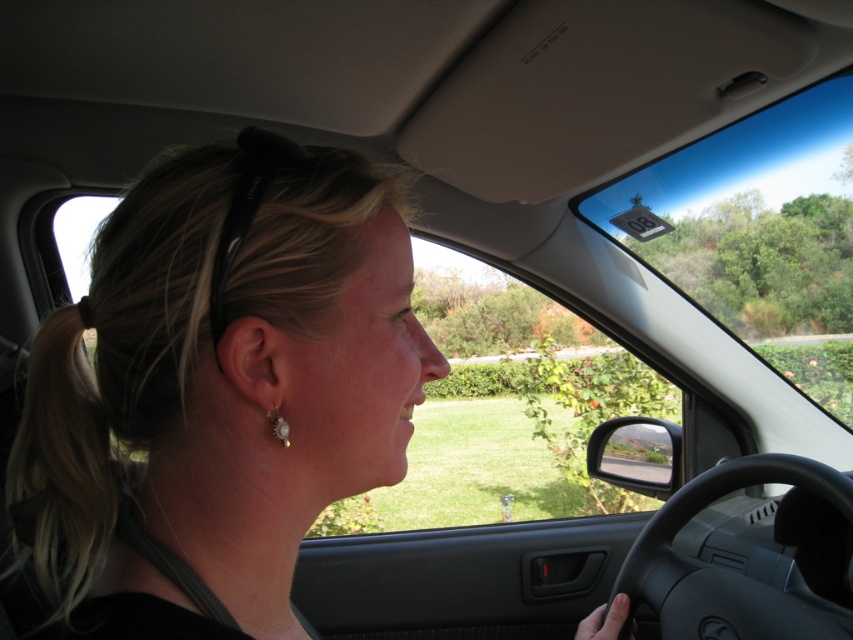
You are a passenger in the car and want to point out two strands of blonde hair in the image. How far apart are the blonde hair at center and the blonde hair at left?

The blonde hair at center and the blonde hair at left are 2.58 inches apart from each other.

You are a passenger in the car and looking out the windshield. You see two points marked on the road ahead. The first point is at coordinate point(57, 385) and the second is at point(849, 496). Which point is closer to the car?

Point(57, 385) is closer to the car because it is in front of point(849, 496).